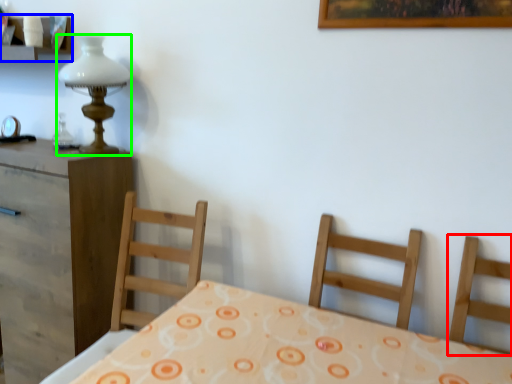
Question: Which object is the closest to the chair (highlighted by a red box)? Choose among these: shelf (highlighted by a blue box) or table lamp (highlighted by a green box).

Choices:
 (A) shelf
 (B) table lamp

Answer: (B)